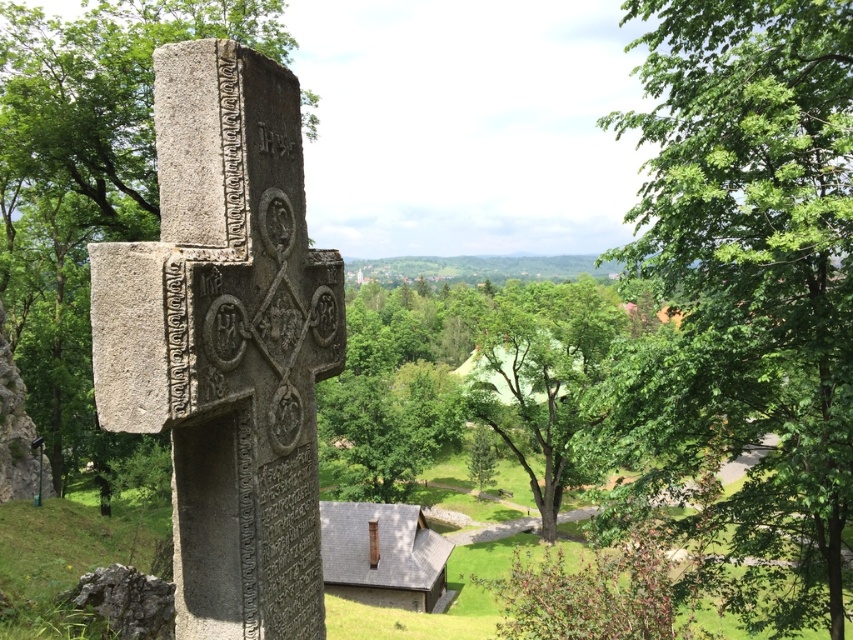
You are standing in the scene and want to reach the point at coordinates point (723, 93). If you can walk 40 feet in 1 minute, how long will it take you to reach the point?

The point (723, 93) is 39.56 feet from viewer. Since you can walk 40 feet in 1 minute, it will take approximately 1 minute to reach the point.

You are a hiker who wants to take a photo of the green stone cross at center without the green leafy tree at center blocking the view. Where should you move to achieve this?

To take a photo of the green stone cross at center without the green leafy tree at center blocking the view, you should move to a position where you can see behind the green leafy tree at center. Since the green stone cross at center is behind the green leafy tree at center, moving to a spot where the tree is no longer in front of the cross would allow an unobstructed view.